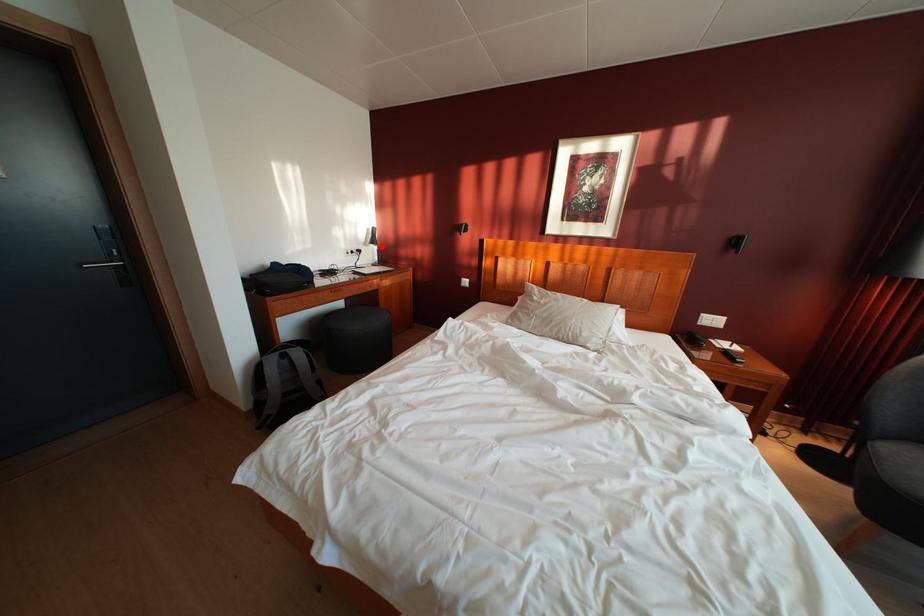
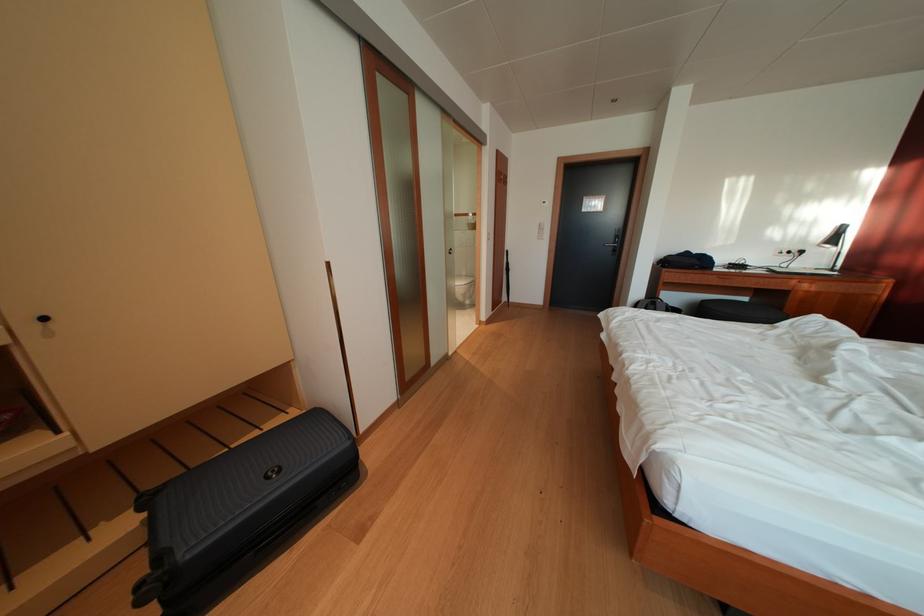
Question: I am providing you with two images of the same scene from different viewpoints. A red point is shown in image1. For the corresponding object point in image2, is it positioned nearer or farther from the camera?

Choices:
 (A) Nearer
 (B) Farther

Answer: (B)